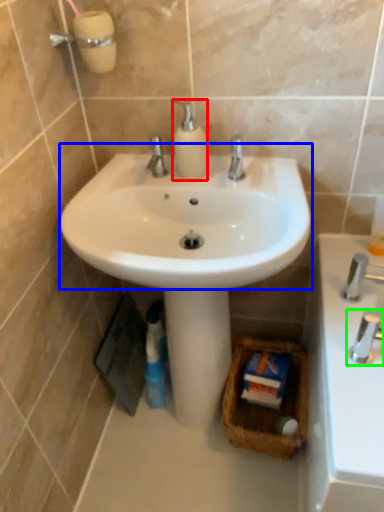
Question: Considering the real-world distances, which object is closest to soap dispenser (highlighted by a red box)? sink (highlighted by a blue box) or tap (highlighted by a green box).

Choices:
 (A) sink
 (B) tap

Answer: (A)